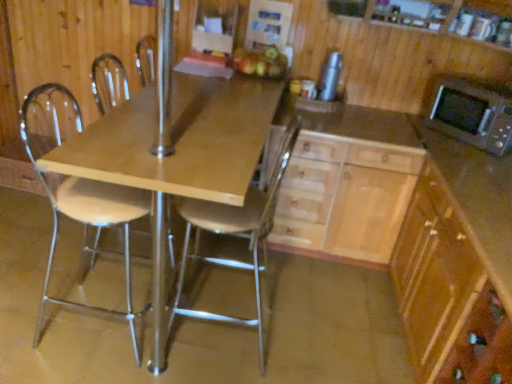
The height and width of the screenshot is (384, 512). I want to click on free space in front of silver metallic microwave oven at upper right, so click(x=467, y=159).